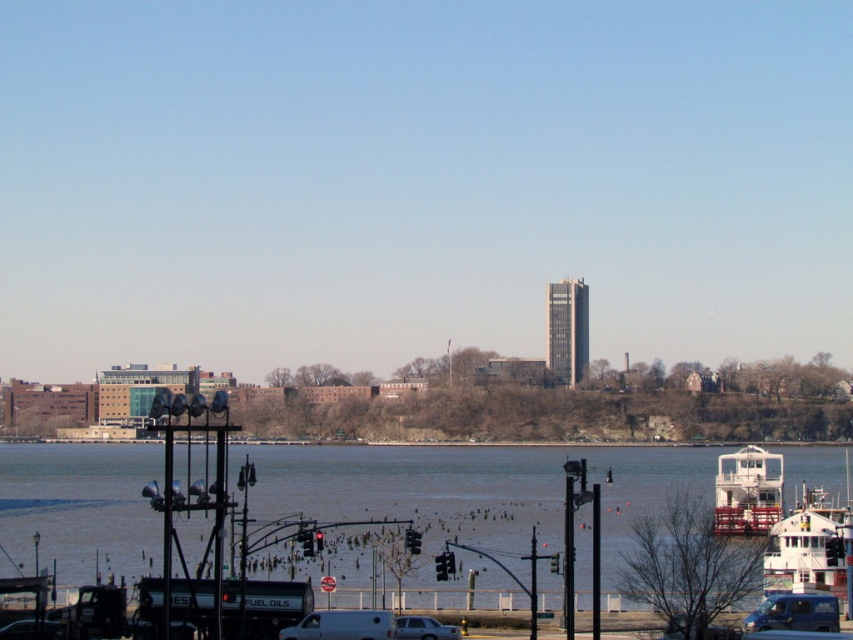
Is point (717, 461) farther from viewer compared to point (357, 620)?

That is True.

Which is in front, point (776, 518) or point (352, 637)?

Positioned in front is point (352, 637).

Image resolution: width=853 pixels, height=640 pixels. What are the coordinates of `white glossy boat at lower right` in the screenshot? It's located at (747, 492).

Image resolution: width=853 pixels, height=640 pixels. I want to click on white glossy boat at lower right, so click(x=747, y=492).

Which is in front, point (51, 525) or point (425, 634)?

Point (425, 634) is in front.

Measure the distance between point (520, 480) and camera.

Point (520, 480) and camera are 222.00 meters apart.

In order to click on brown water at center in this screenshot , I will do `click(418, 492)`.

Is brown water at center behind white glossy boat at lower right?

No, brown water at center is closer to the viewer.

Who is more distant from viewer, (189, 548) or (753, 522)?

Positioned behind is point (753, 522).

You are a GUI agent. You are given a task and a screenshot of the screen. Output one action in this format:
    pyautogui.click(x=<x>, y=<y>)
    Task: Click on the brown water at center
    The width and height of the screenshot is (853, 640).
    Given the screenshot: What is the action you would take?
    [x=418, y=492]